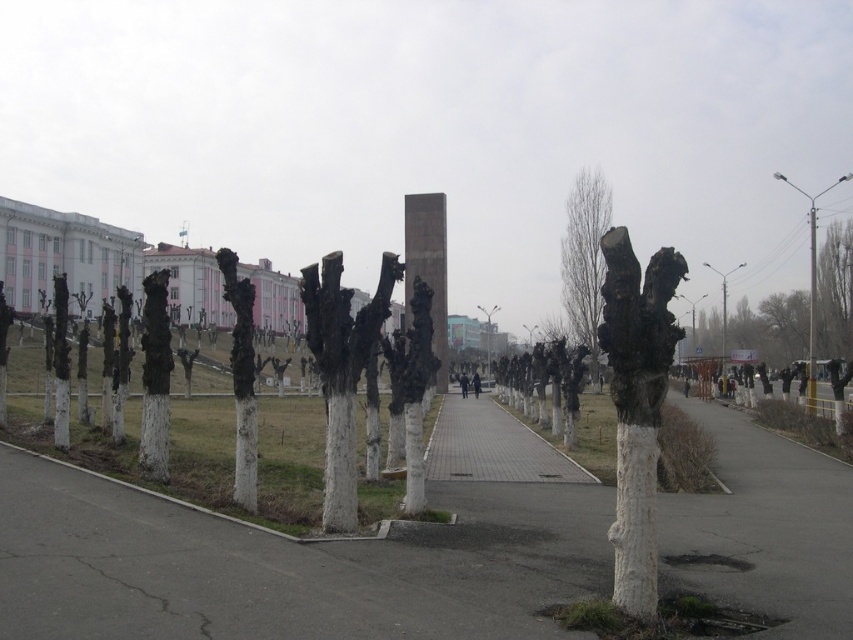
Is black matte sculpture at center positioned in front of smooth white tree trunk at center?

Yes, it is in front of smooth white tree trunk at center.

Between black matte sculpture at center and smooth white tree trunk at center, which one appears on the left side from the viewer's perspective?

smooth white tree trunk at center is more to the left.

Where is `black matte sculpture at center`? The height and width of the screenshot is (640, 853). black matte sculpture at center is located at coordinates (341, 371).

Where is `black matte sculpture at center`? black matte sculpture at center is located at coordinates (341, 371).

Can you confirm if white painted wood tree stump at right is shorter than smooth bark tree at center?

Correct, white painted wood tree stump at right is not as tall as smooth bark tree at center.

Measure the distance from white painted wood tree stump at right to smooth bark tree at center.

white painted wood tree stump at right and smooth bark tree at center are 50.95 meters apart.

Does point (614, 602) come in front of point (596, 365)?

That is True.

Where is `white painted wood tree stump at right`? The image size is (853, 640). white painted wood tree stump at right is located at coordinates (636, 404).

Can you confirm if black matte sculpture at center is taller than metallic pole at right?

No, black matte sculpture at center is not taller than metallic pole at right.

Where is `black matte sculpture at center`? The height and width of the screenshot is (640, 853). black matte sculpture at center is located at coordinates (341, 371).

At what (x,y) coordinates should I click in order to perform the action: click on black matte sculpture at center. Please return your answer as a coordinate pair (x, y). Looking at the image, I should click on (341, 371).